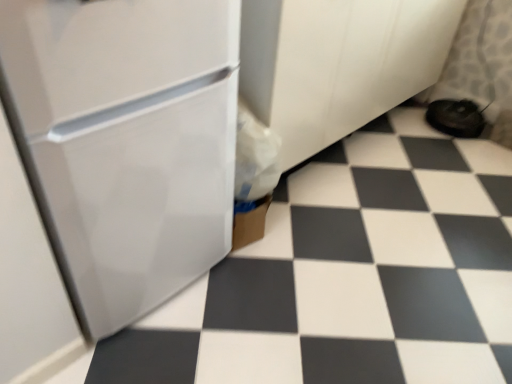
Question: Can you confirm if white glossy tile at center is positioned to the right of white glossy refrigerator at left?

Choices:
 (A) no
 (B) yes

Answer: (B)

Question: Can you confirm if white glossy tile at center is wider than white glossy refrigerator at left?

Choices:
 (A) yes
 (B) no

Answer: (A)

Question: Does white glossy tile at center appear on the left side of white glossy refrigerator at left?

Choices:
 (A) no
 (B) yes

Answer: (A)

Question: From the image's perspective, is white glossy tile at center on white glossy refrigerator at left?

Choices:
 (A) no
 (B) yes

Answer: (A)

Question: Can you confirm if white glossy tile at center is thinner than white glossy refrigerator at left?

Choices:
 (A) yes
 (B) no

Answer: (B)

Question: Looking at the image, does black fabric shoe at lower right seem bigger or smaller compared to white glossy tile at center?

Choices:
 (A) small
 (B) big

Answer: (A)

Question: Is black fabric shoe at lower right wider or thinner than white glossy tile at center?

Choices:
 (A) wide
 (B) thin

Answer: (B)

Question: Would you say black fabric shoe at lower right is to the left or to the right of white glossy tile at center in the picture?

Choices:
 (A) left
 (B) right

Answer: (B)

Question: Does point (484, 122) appear closer or farther from the camera than point (228, 357)?

Choices:
 (A) farther
 (B) closer

Answer: (A)

Question: Do you think white glossy tile at center is within white glossy refrigerator at left, or outside of it?

Choices:
 (A) outside
 (B) inside

Answer: (A)

Question: Considering the positions of white glossy tile at center and white glossy refrigerator at left in the image, is white glossy tile at center taller or shorter than white glossy refrigerator at left?

Choices:
 (A) short
 (B) tall

Answer: (A)

Question: From a real-world perspective, relative to white glossy refrigerator at left, is white glossy tile at center vertically above or below?

Choices:
 (A) above
 (B) below

Answer: (B)

Question: In terms of width, does white glossy tile at center look wider or thinner when compared to white glossy refrigerator at left?

Choices:
 (A) wide
 (B) thin

Answer: (A)

Question: Considering the relative positions of black fabric shoe at lower right and white glossy refrigerator at left in the image provided, is black fabric shoe at lower right to the left or to the right of white glossy refrigerator at left?

Choices:
 (A) right
 (B) left

Answer: (A)

Question: Considering the positions of black fabric shoe at lower right and white glossy refrigerator at left in the image, is black fabric shoe at lower right taller or shorter than white glossy refrigerator at left?

Choices:
 (A) tall
 (B) short

Answer: (B)